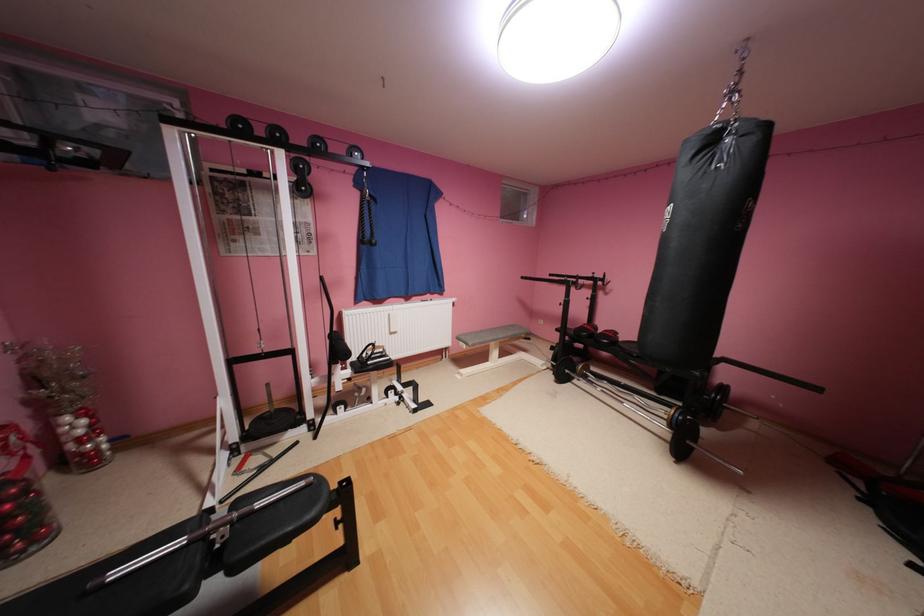
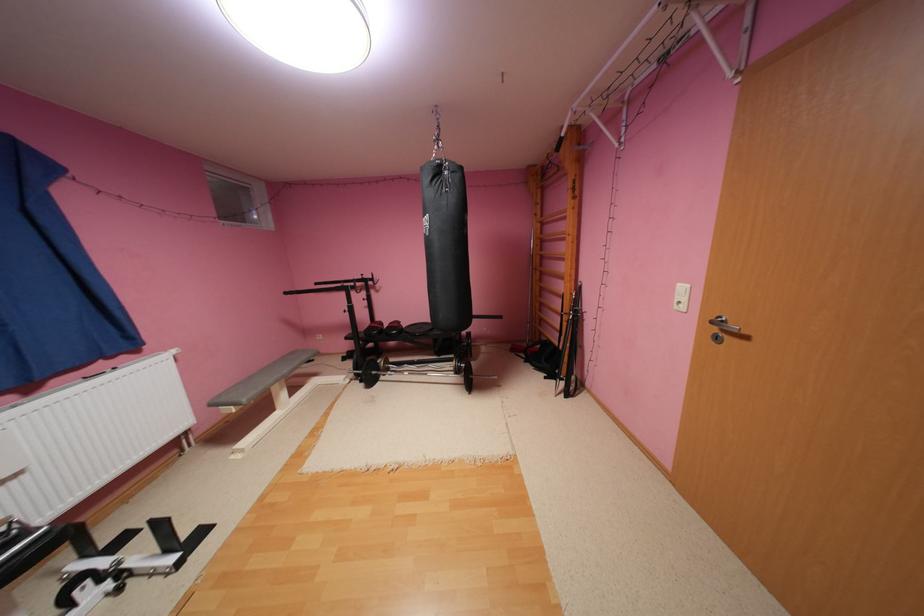
Find the pixel in the second image that matches pixel 531 278 in the first image.

(295, 293)